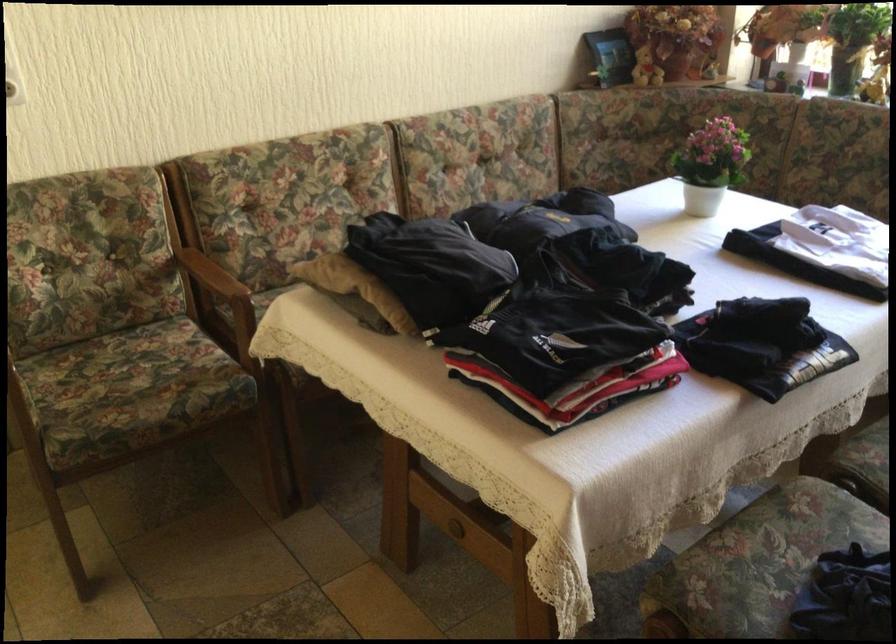
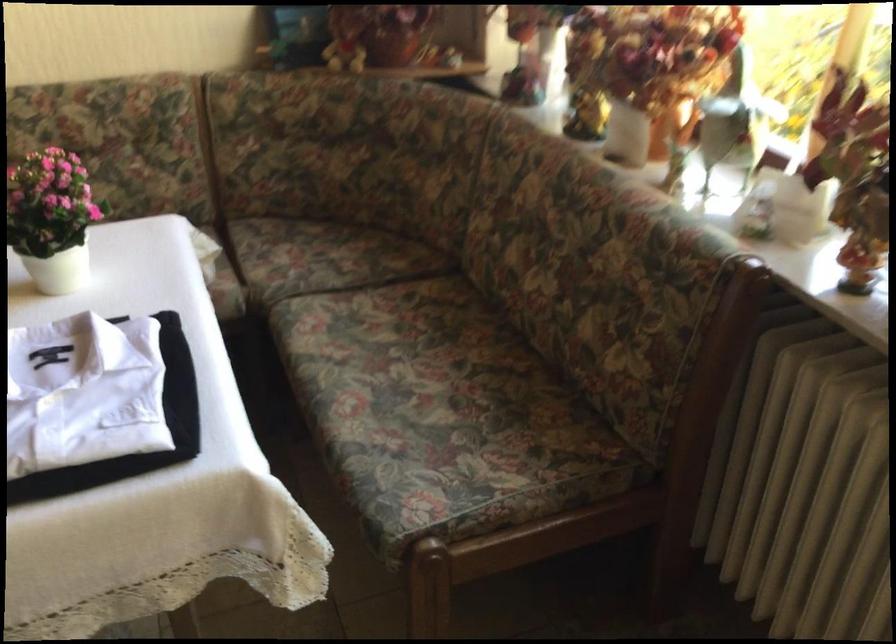
Where in the second image is the point corresponding to the point at 721,158 from the first image?

(52, 218)